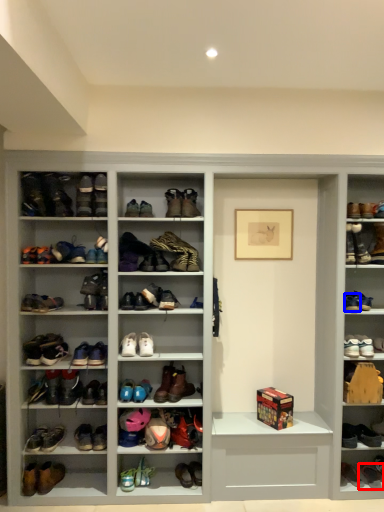
Question: Which object appears farthest to the camera in this image, footwear (highlighted by a red box) or footwear (highlighted by a blue box)?

Choices:
 (A) footwear
 (B) footwear

Answer: (A)